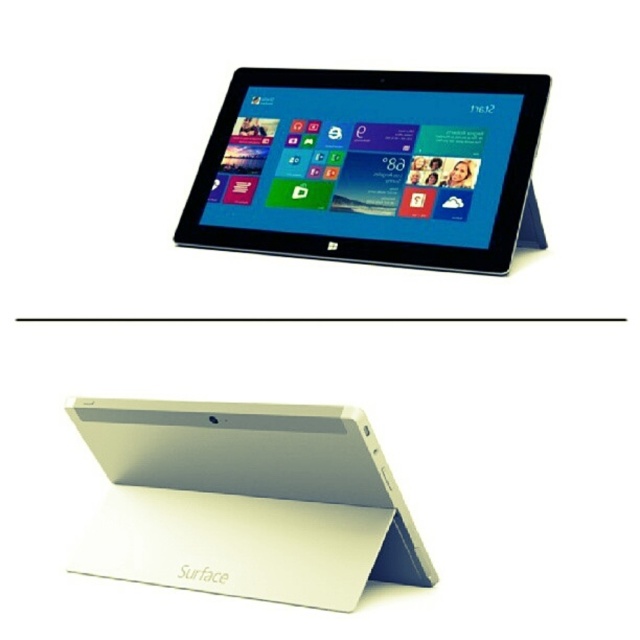
Is white matte tablet at upper center closer to the viewer compared to white matte surface at upper center?

That is False.

How far apart are white matte tablet at upper center and white matte surface at upper center?

22.51 inches

You are a GUI agent. You are given a task and a screenshot of the screen. Output one action in this format:
    pyautogui.click(x=<x>, y=<y>)
    Task: Click on the white matte tablet at upper center
    The image size is (640, 640).
    Given the screenshot: What is the action you would take?
    pyautogui.click(x=369, y=166)

The height and width of the screenshot is (640, 640). What are the coordinates of `white matte tablet at upper center` in the screenshot? It's located at (369, 166).